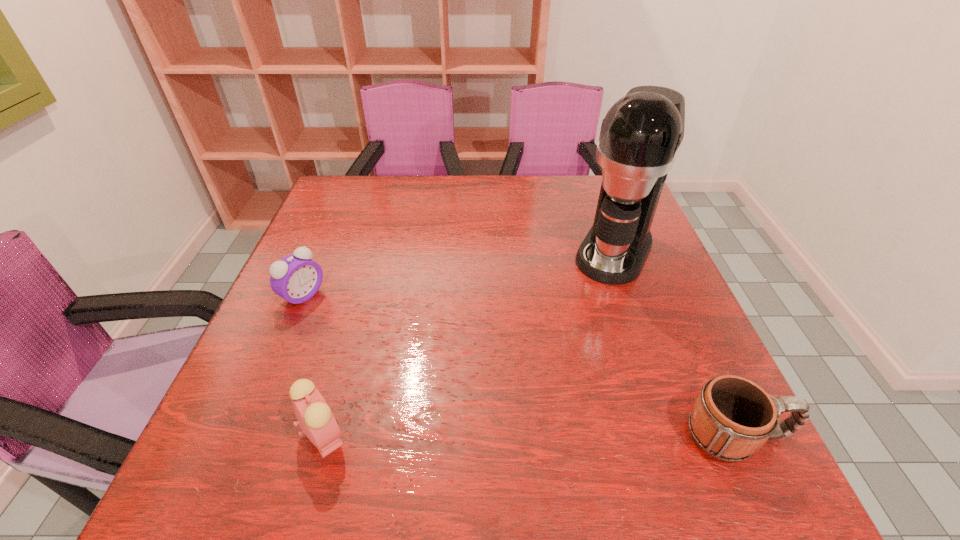
Find the location of a particular element. This screenshot has height=540, width=960. vacant space situated on the face of the farther alarm clock is located at coordinates (421, 372).

Image resolution: width=960 pixels, height=540 pixels. Identify the location of vacant space located on the face of the farther alarm clock. (406, 362).

Locate an element on the screen. The height and width of the screenshot is (540, 960). blank space located on the face of the farther alarm clock is located at coordinates (445, 387).

Identify the location of alarm clock situated at the near edge. (316, 420).

Locate an element on the screen. The width and height of the screenshot is (960, 540). mug that is at the near edge is located at coordinates (732, 417).

What are the coordinates of `mug that is at the right edge` in the screenshot? It's located at point(732,417).

Identify the location of coffee maker positioned at the right edge. The width and height of the screenshot is (960, 540). (641, 135).

Find the location of a particular element. The height and width of the screenshot is (540, 960). object located at the near left corner is located at coordinates (316, 420).

Locate an element on the screen. object located in the near right corner section of the desktop is located at coordinates (732, 417).

Identify the location of free space at the far edge of the desktop. The height and width of the screenshot is (540, 960). (485, 185).